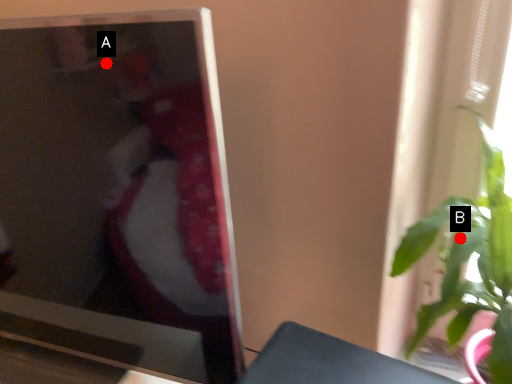
Question: Two points are circled on the image, labeled by A and B beside each circle. Which point is farther to the camera?

Choices:
 (A) A is further
 (B) B is further

Answer: (B)